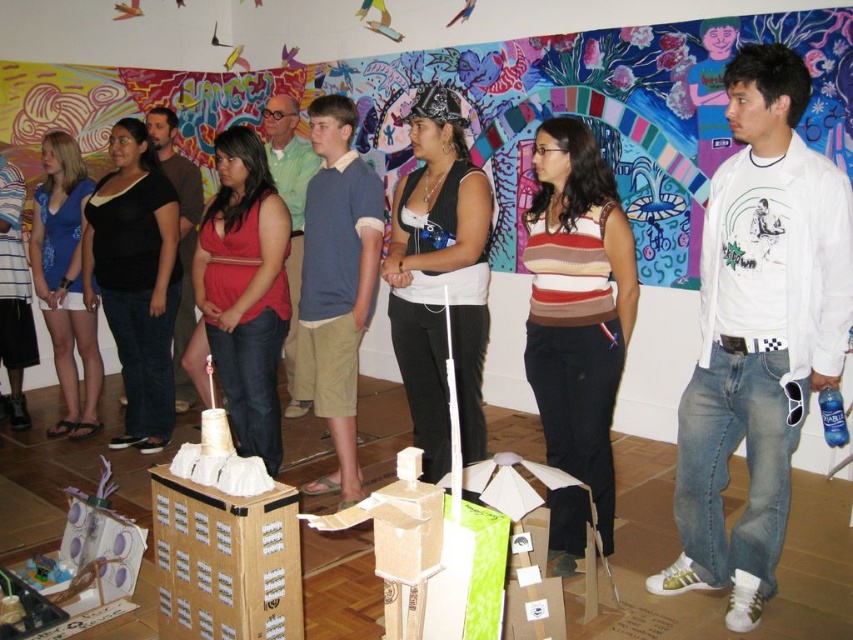
You are standing in the gallery looking at the mural. There are two points marked on the wall in front of you. The first point is at coordinates point (x=286, y=182) and the second point is at point (x=183, y=266). Which point is closer to you?

Point (x=286, y=182) is closer to the viewer than point (x=183, y=266).

You are an artist trying to arrange two shirts for a photo shoot. You have a blue cotton shirt at center and a black cotton shirt at center. Since you want the larger shirt to be the focal point, which shirt should you place in the foreground?

The blue cotton shirt at center is larger in size than the black cotton shirt at center, so you should place the blue cotton shirt at center in the foreground to make it the focal point.

From the picture: You are an artist standing in the gallery and want to place a 60 cm wide sculpture between the blue cotton shirt at center and the black cotton shirt at center. Can you fit it there?

The blue cotton shirt at center and black cotton shirt at center are 65.19 centimeters apart. Since the sculpture is 60 cm wide, it can fit between them as the space is wider than the sculpture.